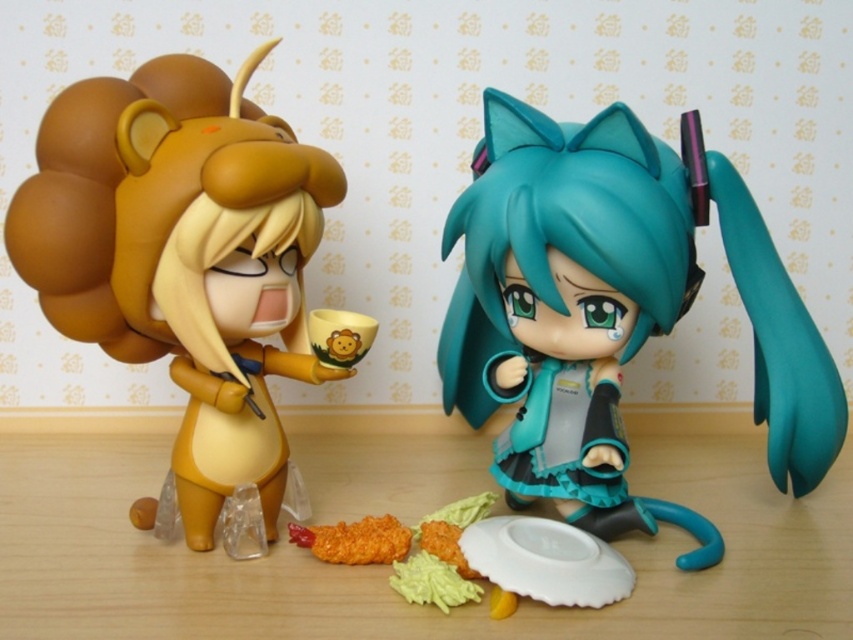
Question: Is teal glossy hair at center bigger than yellow matte cup at center?

Choices:
 (A) yes
 (B) no

Answer: (A)

Question: Which object is farther from the camera taking this photo?

Choices:
 (A) matte brown lion at left
 (B) golden crispy chicken at center

Answer: (B)

Question: Is yellow matte mashed potato at lower center behind yellow matte cup at center?

Choices:
 (A) yes
 (B) no

Answer: (B)

Question: Estimate the real-world distances between objects in this image. Which object is closer to the yellow matte cup at center?

Choices:
 (A) teal glossy hair at center
 (B) matte brown lion at left

Answer: (B)

Question: Does teal glossy hair at center appear on the right side of yellow matte mashed potato at lower center?

Choices:
 (A) no
 (B) yes

Answer: (B)

Question: Among these objects, which one is nearest to the camera?

Choices:
 (A) teal glossy hair at center
 (B) golden crispy chicken at center
 (C) wooden table at center

Answer: (C)